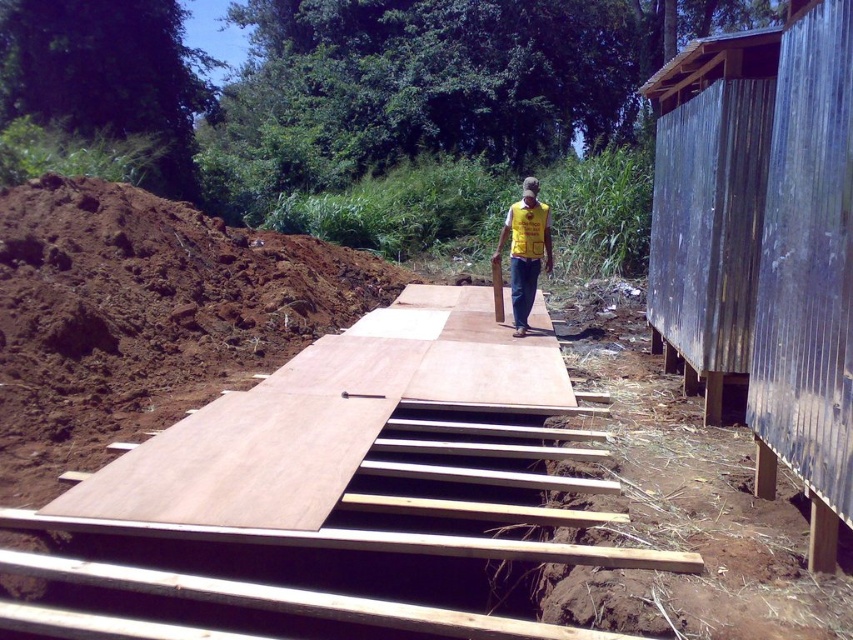
Question: Which point is farther to the camera?

Choices:
 (A) yellow fabric vest at center
 (B) metallic corrugated hut at right

Answer: (A)

Question: Is metallic corrugated hut at right thinner than yellow fabric vest at center?

Choices:
 (A) no
 (B) yes

Answer: (B)

Question: Is metallic corrugated hut at right positioned at the back of yellow fabric vest at center?

Choices:
 (A) yes
 (B) no

Answer: (B)

Question: Is metallic corrugated hut at right closer to the viewer compared to yellow fabric vest at center?

Choices:
 (A) no
 (B) yes

Answer: (B)